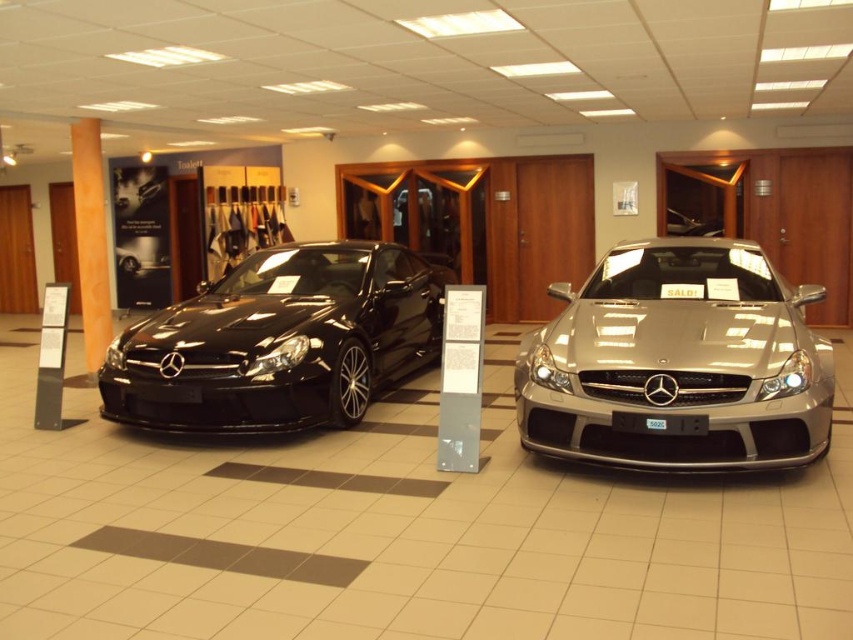
Question: Which of the following is the farthest from the observer?

Choices:
 (A) satin silver car at center
 (B) matte black car at left

Answer: (B)

Question: Which point appears farthest from the camera in this image?

Choices:
 (A) (113, 362)
 (B) (776, 333)

Answer: (A)

Question: Which of the following is the closest to the observer?

Choices:
 (A) matte black car at left
 (B) satin silver car at center

Answer: (B)

Question: Does satin silver car at center have a greater width compared to matte black car at left?

Choices:
 (A) yes
 (B) no

Answer: (B)

Question: Is satin silver car at center closer to camera compared to matte black car at left?

Choices:
 (A) yes
 (B) no

Answer: (A)

Question: Is satin silver car at center to the left of matte black car at left from the viewer's perspective?

Choices:
 (A) yes
 (B) no

Answer: (B)